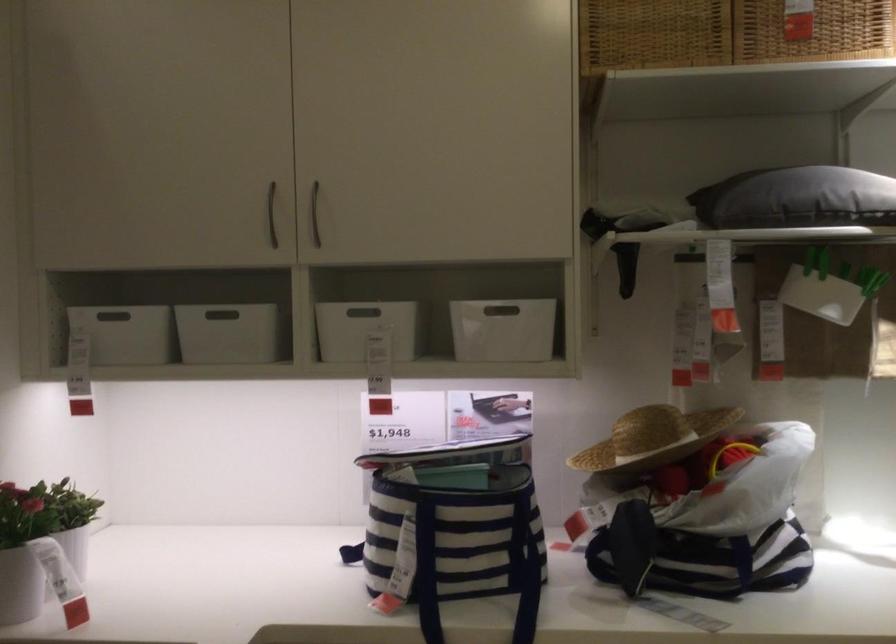
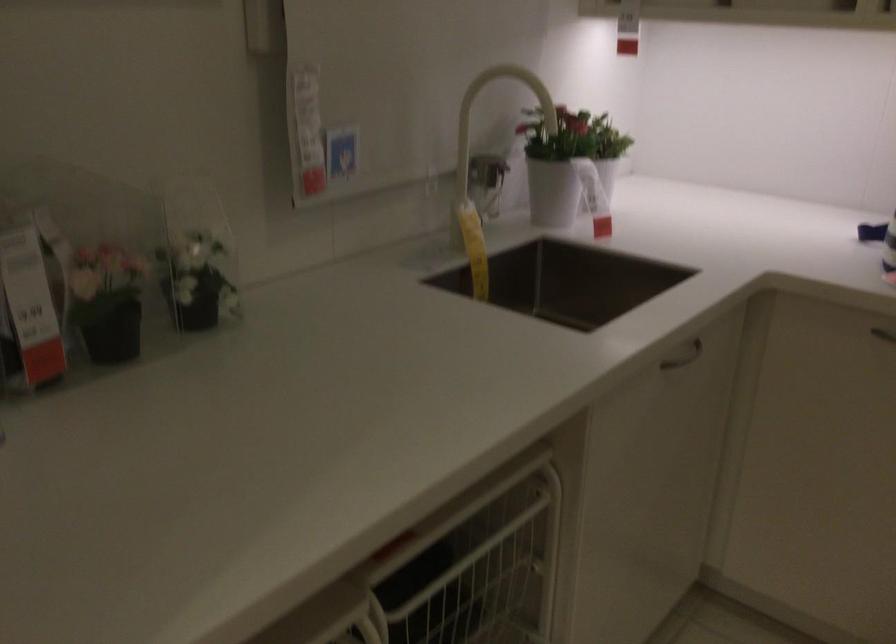
Where in the second image is the point corresponding to [73,556] from the first image?

(604, 180)